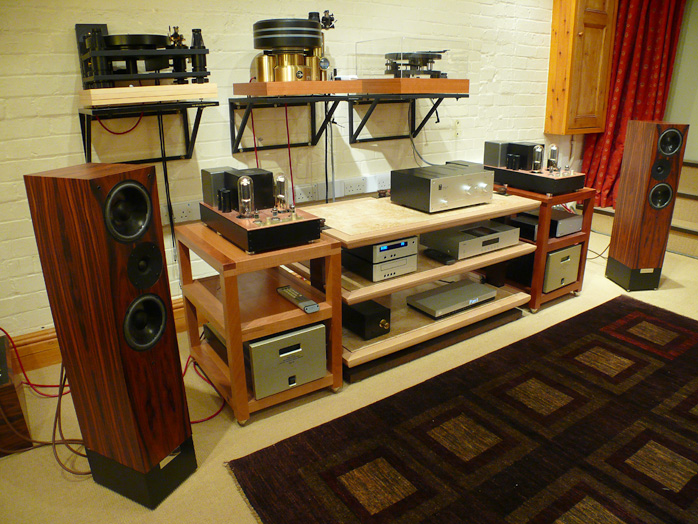
The image size is (698, 524). What are the coordinates of `curtain` in the screenshot? It's located at (643, 70).